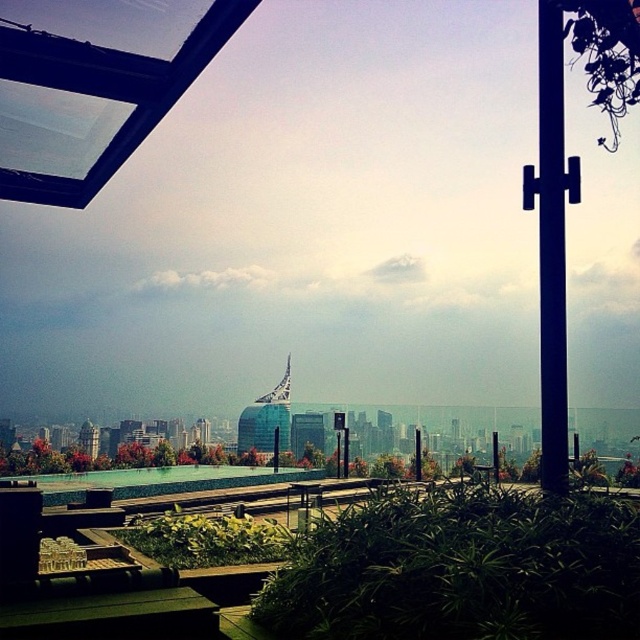
You are standing at the edge of the infinity pool and want to reach the black metal pole at right without stepping on any tables or chairs. What is the minimum distance you need to walk?

The minimum distance you need to walk is 2.17 meters to reach the black metal pole at right from the camera position, which is the edge of the infinity pool.

Based on the photo, you are standing at the edge of the infinity pool and want to take a photo of both the point at coordinates (x=563, y=284) and the point at (x=346, y=464). Which point will appear larger in your photo?

The point at coordinates (x=563, y=284) will appear larger in the photo because it is closer to the camera than the point at (x=346, y=464).